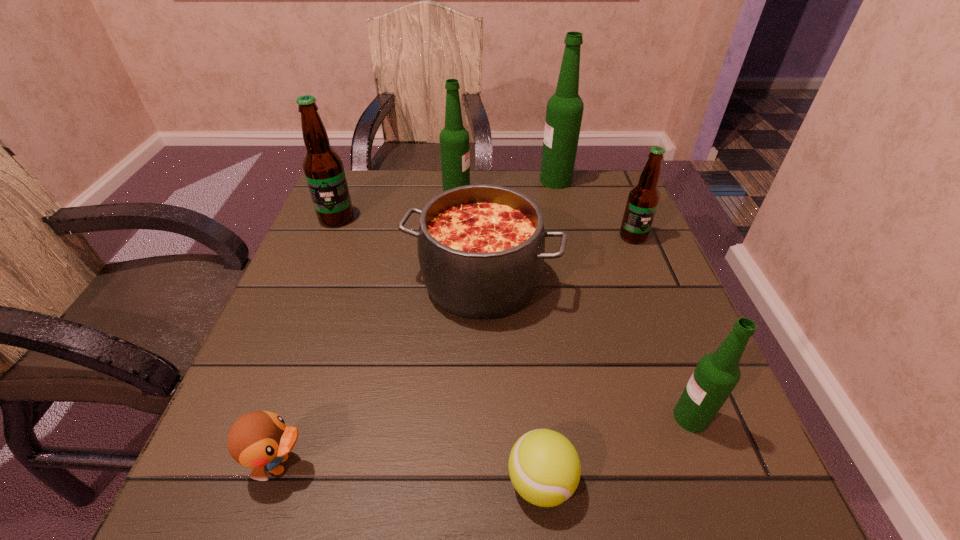
Where is `the tallest beer bottle`? This screenshot has height=540, width=960. the tallest beer bottle is located at coordinates 564,111.

At what (x,y) coordinates should I click in order to perform the action: click on the sixth object from left to right. Please return your answer as a coordinate pair (x, y). This screenshot has height=540, width=960. Looking at the image, I should click on (564, 111).

Identify the location of the second beer bottle from left to right. (454, 140).

Identify the location of the second smallest green beer bottle. The height and width of the screenshot is (540, 960). (454, 140).

Where is `the leftmost beer bottle`? The width and height of the screenshot is (960, 540). the leftmost beer bottle is located at coordinates (323, 168).

The width and height of the screenshot is (960, 540). Find the location of `the left brown beer bottle`. the left brown beer bottle is located at coordinates (323, 168).

Where is `the nearest green beer bottle`? The width and height of the screenshot is (960, 540). the nearest green beer bottle is located at coordinates (716, 375).

You are a GUI agent. You are given a task and a screenshot of the screen. Output one action in this format:
    pyautogui.click(x=<x>, y=<y>)
    Task: Click on the rightmost green beer bottle
    
    Given the screenshot: What is the action you would take?
    pyautogui.click(x=716, y=375)

Where is `the smaller brown beer bottle`? the smaller brown beer bottle is located at coordinates (643, 199).

Locate an element on the screen. Image resolution: width=960 pixels, height=540 pixels. the fifth farthest object is located at coordinates (481, 248).